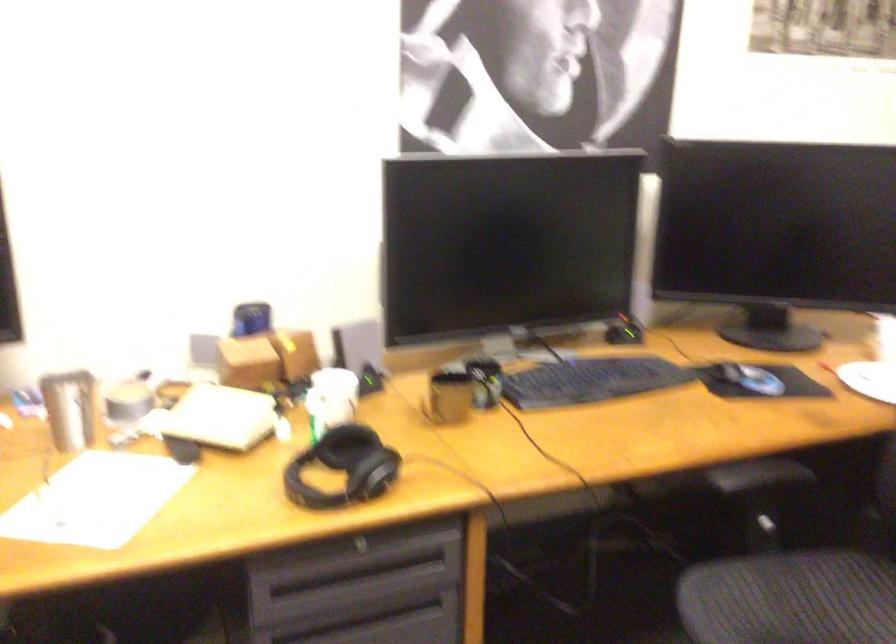
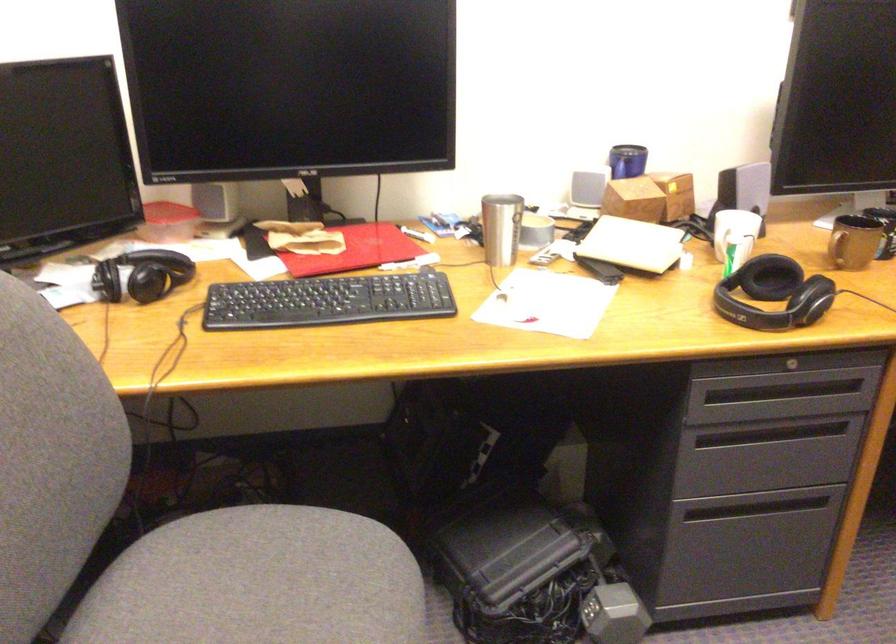
Find the pixel in the second image that matches the point at 444,406 in the first image.

(854, 242)